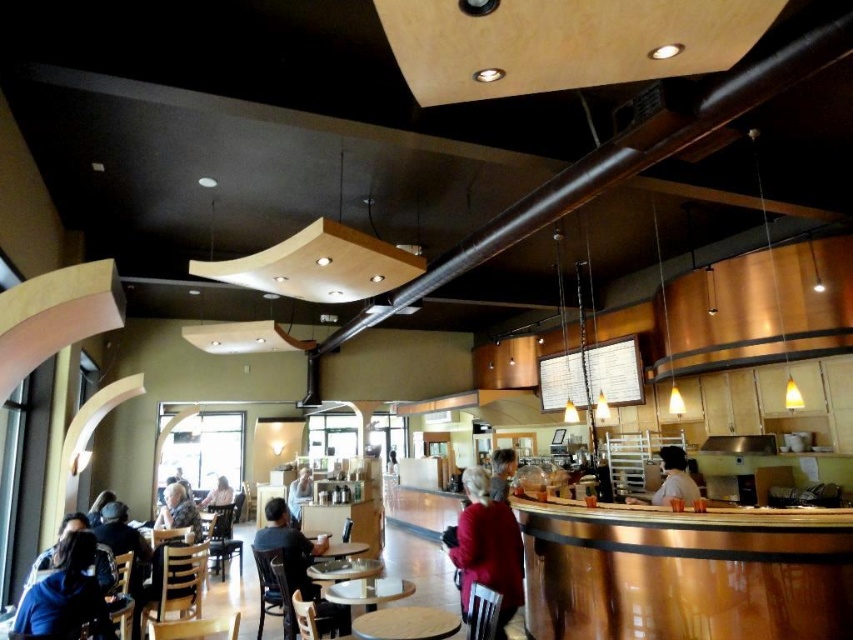
Question: Which point is closer to the camera?

Choices:
 (A) dark blue shirt at center
 (B) smooth beige sweater at center
 (C) light blue shirt at center
 (D) light brown wooden chair at center

Answer: (A)

Question: Does matte red coat at center appear on the left side of light brown wooden table at center?

Choices:
 (A) no
 (B) yes

Answer: (A)

Question: Can you confirm if dark blue shirt at center is wider than wooden table at center?

Choices:
 (A) no
 (B) yes

Answer: (B)

Question: Among these points, which one is nearest to the camera?

Choices:
 (A) (331, 602)
 (B) (664, 456)
 (C) (299, 499)
 (D) (397, 472)

Answer: (A)

Question: Does white fabric shirt at counter appear under dark gray sweater at center?

Choices:
 (A) no
 (B) yes

Answer: (A)

Question: Estimate the real-world distances between objects in this image. Which object is farther from the light brown wooden table at center?

Choices:
 (A) light brown wooden chair at center
 (B) dark blue shirt at center

Answer: (A)